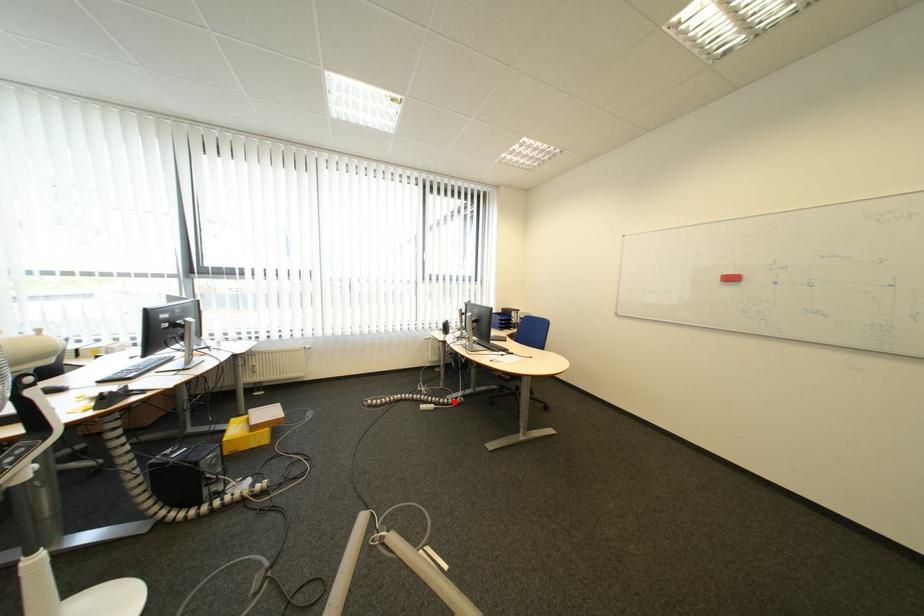
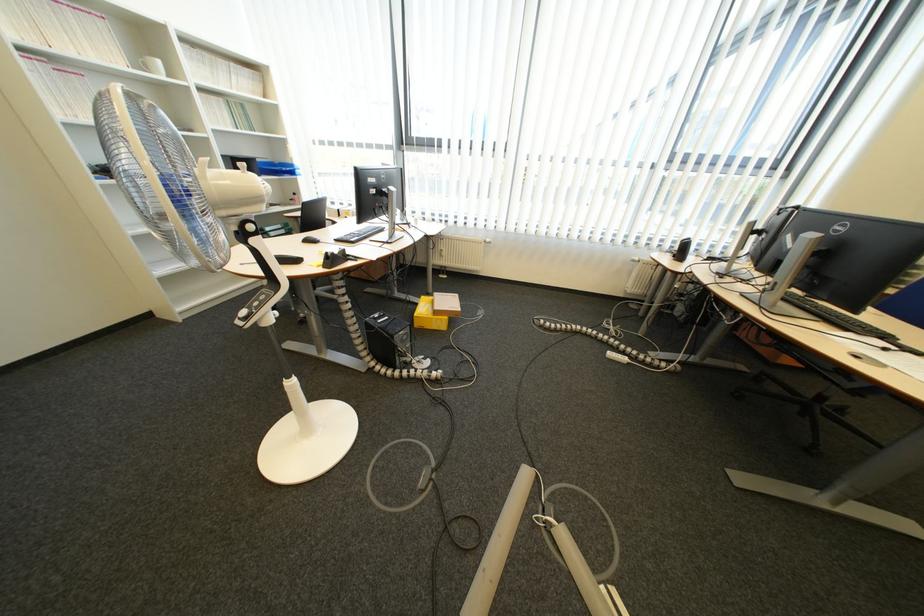
Where in the second image is the point corresponding to the highlighted location from the first image?

(654, 358)